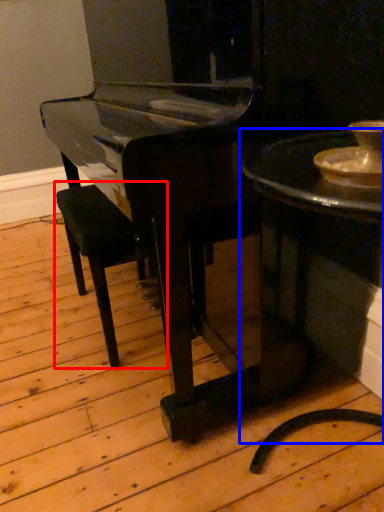
Question: Among these objects, which one is nearest to the camera, armchair (highlighted by a red box) or table (highlighted by a blue box)?

Choices:
 (A) armchair
 (B) table

Answer: (B)